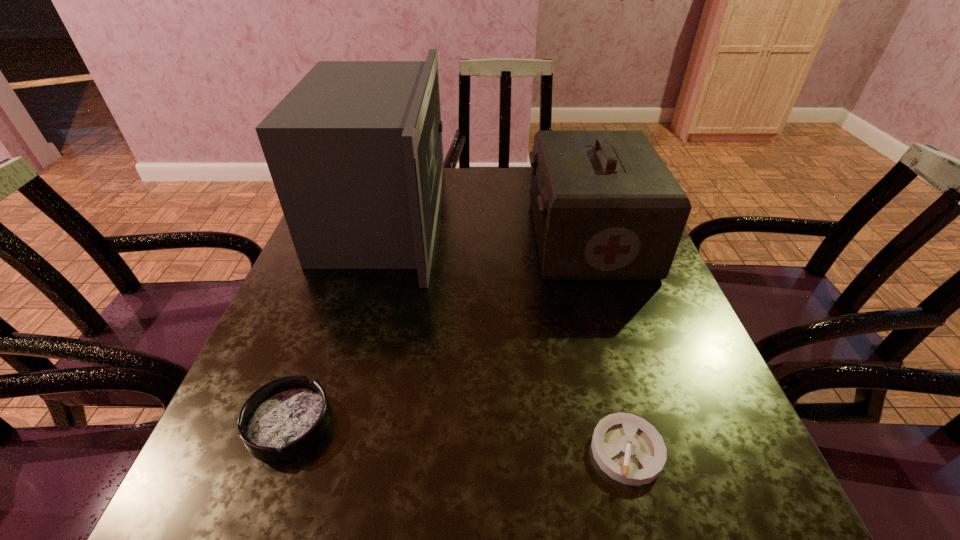
Locate an element on the screen. The height and width of the screenshot is (540, 960). the tallest object is located at coordinates (354, 150).

Find the location of a particular element. The width and height of the screenshot is (960, 540). the first-aid kit is located at coordinates (605, 206).

At what (x,y) coordinates should I click in order to perform the action: click on the left ashtray. Please return your answer as a coordinate pair (x, y). Image resolution: width=960 pixels, height=540 pixels. Looking at the image, I should click on (284, 418).

Where is `the second shortest object`? The width and height of the screenshot is (960, 540). the second shortest object is located at coordinates (284, 418).

Locate an element on the screen. This screenshot has width=960, height=540. the shorter ashtray is located at coordinates (630, 450).

Locate an element on the screen. The image size is (960, 540). the right ashtray is located at coordinates (630, 450).

Image resolution: width=960 pixels, height=540 pixels. In order to click on blank space located on the front-facing side of the tallest object in this screenshot , I will do `click(537, 218)`.

Find the location of a particular element. The image size is (960, 540). vacant space located on the left of the first-aid kit is located at coordinates (488, 238).

Where is `free space located 0.380m on the right of the left ashtray`? free space located 0.380m on the right of the left ashtray is located at coordinates (569, 423).

The height and width of the screenshot is (540, 960). What are the coordinates of `free space located on the left of the shorter ashtray` in the screenshot? It's located at (341, 450).